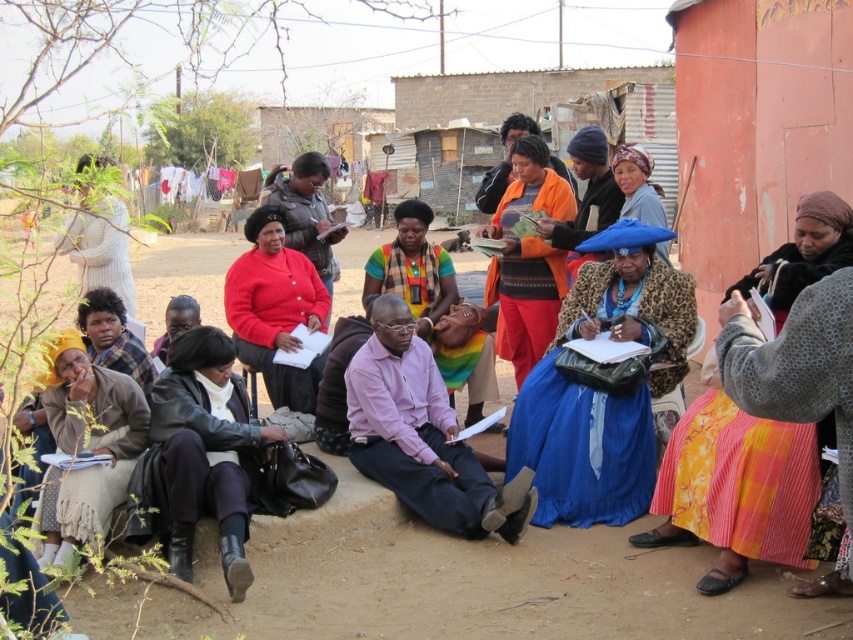
Question: Among these points, which one is nearest to the camera?

Choices:
 (A) (471, 330)
 (B) (90, 372)

Answer: (B)

Question: Does yellow printed skirt at lower right appear on the left side of matte plaid shirt at lower left?

Choices:
 (A) no
 (B) yes

Answer: (A)

Question: Observing the image, what is the correct spatial positioning of yellow printed skirt at lower right in reference to orange fabric at center?

Choices:
 (A) below
 (B) above

Answer: (A)

Question: Which point is farther to the camera?

Choices:
 (A) matte red sweater at center
 (B) leather jacket at center
 (C) blue leopard print coat at center

Answer: (A)

Question: Which point is closer to the camera taking this photo?

Choices:
 (A) (228, 371)
 (B) (469, 563)

Answer: (B)

Question: Can you confirm if beige woven skirt at lower left is positioned to the left of matte plaid shirt at lower left?

Choices:
 (A) yes
 (B) no

Answer: (B)